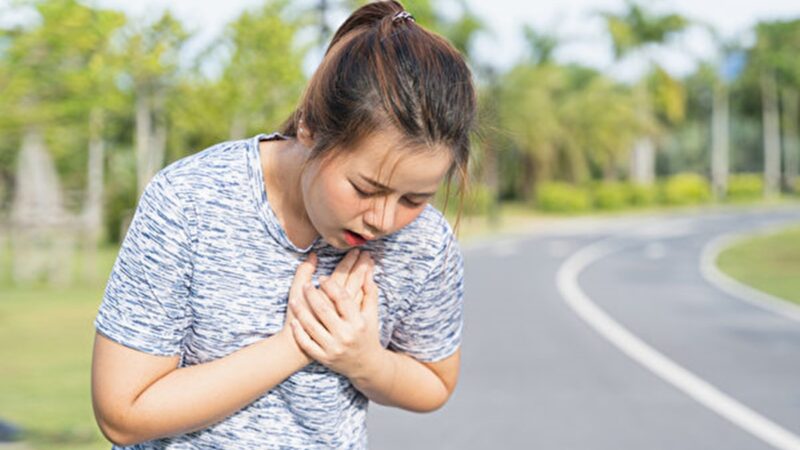
Where is `chest`? Image resolution: width=800 pixels, height=450 pixels. chest is located at coordinates (270, 242).